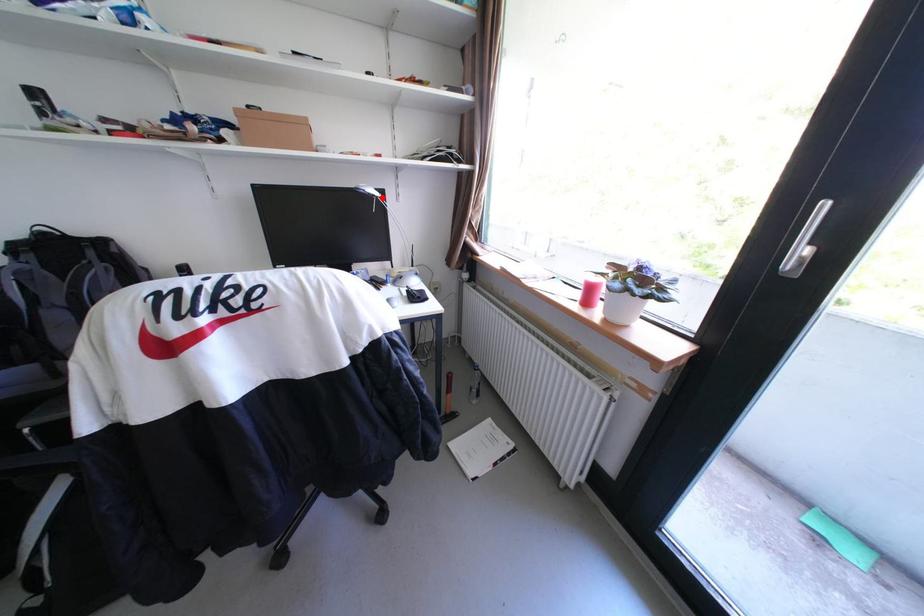
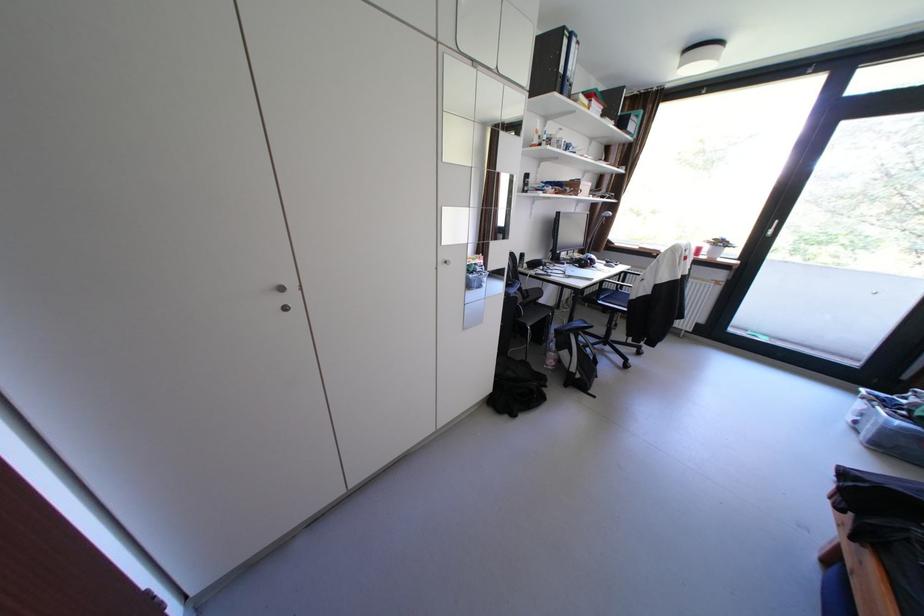
In the second image, find the point that corresponds to the highlighted location in the first image.

(614, 217)